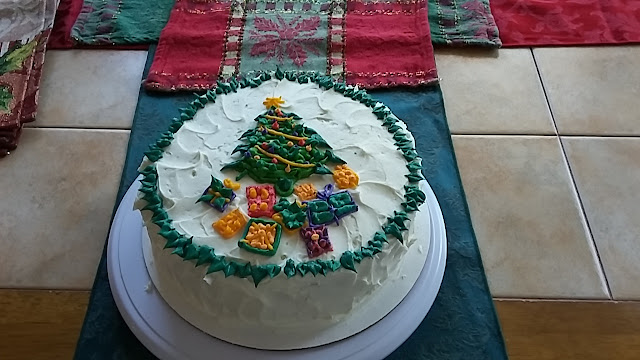
This screenshot has height=360, width=640. I want to click on wood edging on counter, so click(x=38, y=325), click(x=561, y=329), click(x=598, y=301).